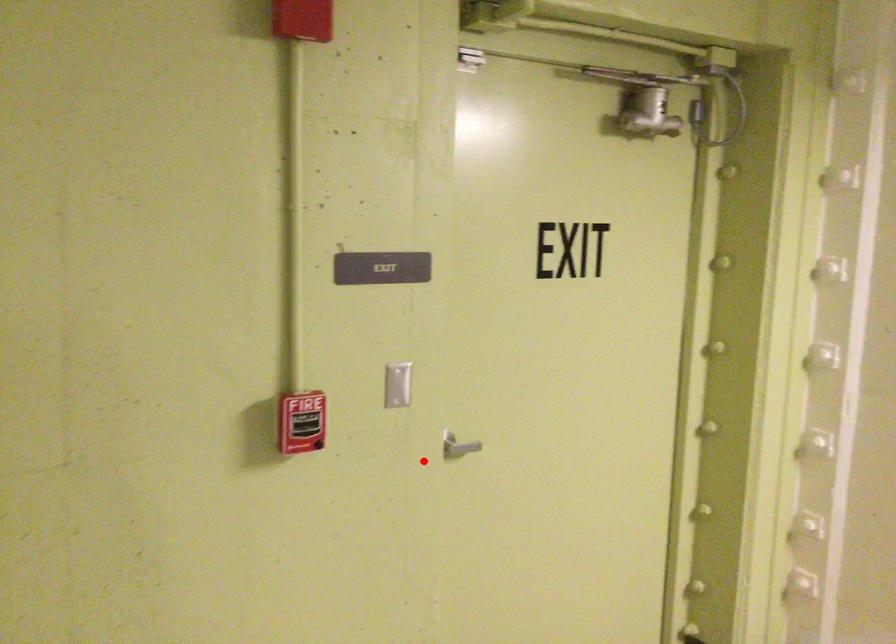
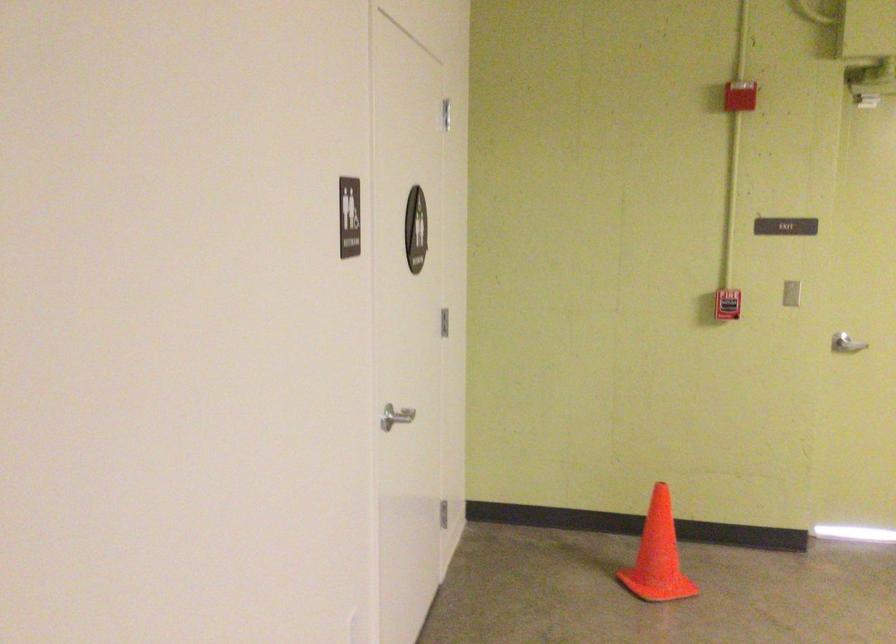
Question: I am providing you with two images of the same scene from different viewpoints. A red point is marked on the first image. Is the red point's position out of view in image 2?

Choices:
 (A) Yes
 (B) No

Answer: (B)